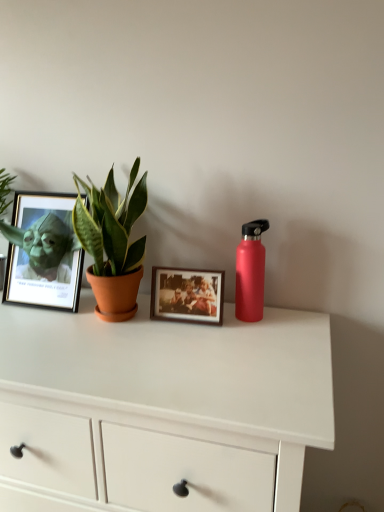
At what (x,y) coordinates should I click in order to perform the action: click on free location in front of matte red water bottle at right. Please return your answer as a coordinate pair (x, y). Image resolution: width=384 pixels, height=512 pixels. Looking at the image, I should click on (254, 345).